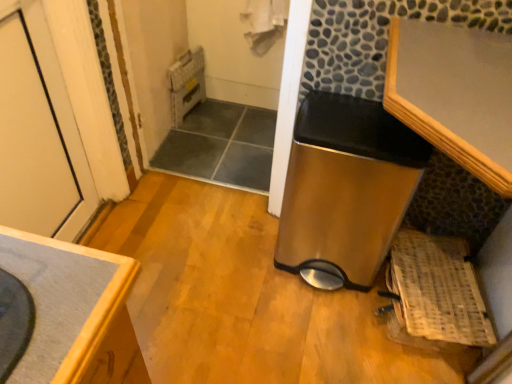
Identify the location of vacant area situated to the left side of stainless steel trash can at center, positioned as the 2th water heater in back-to-front order. This screenshot has height=384, width=512. (236, 256).